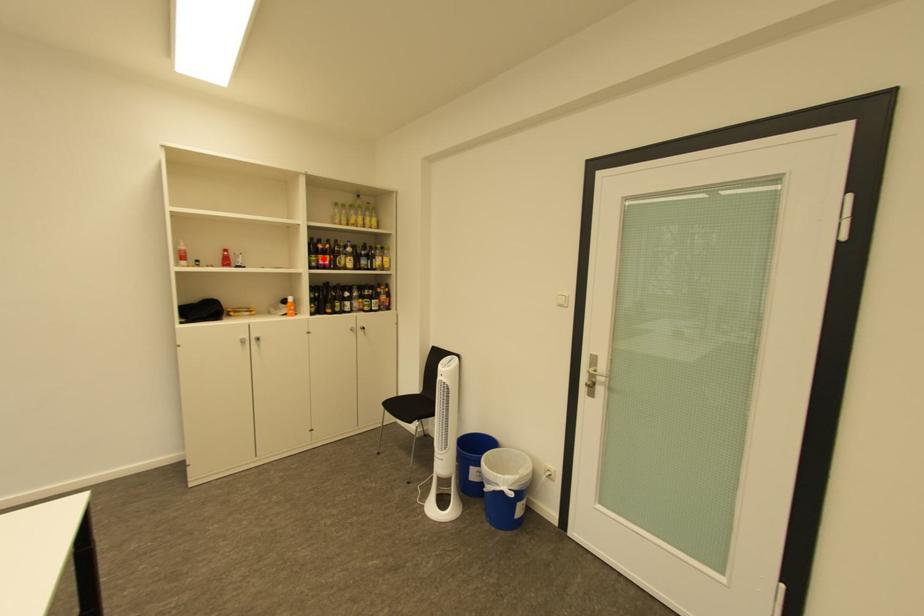
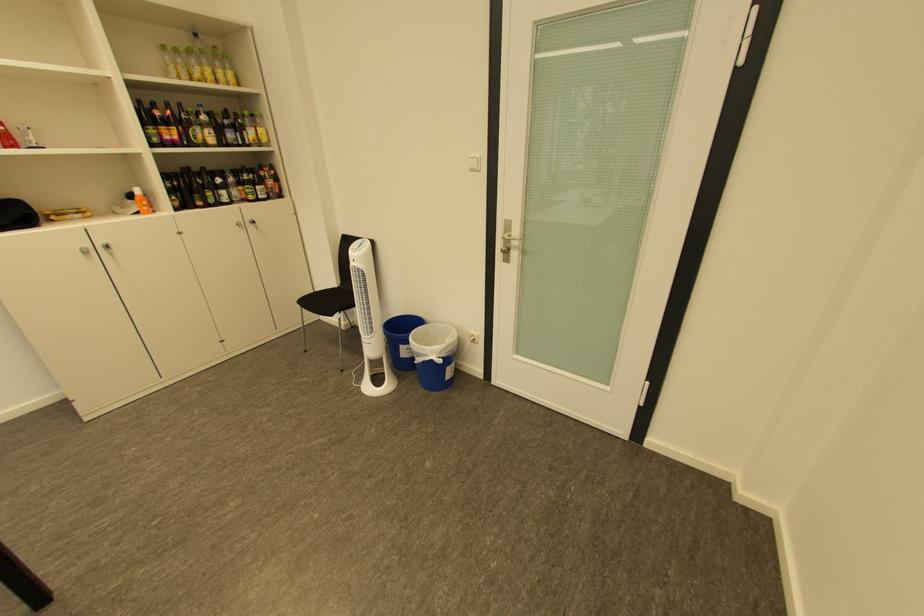
Find the pixel in the second image that matches the highlighted location in the first image.

(162, 132)